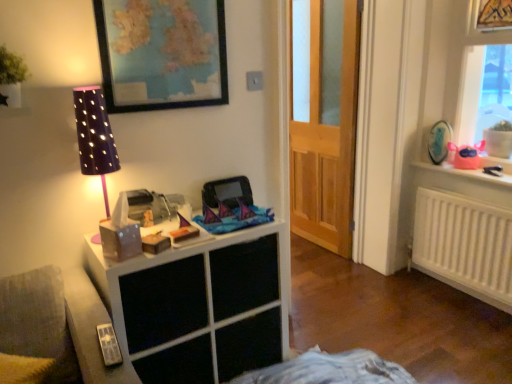
Find the location of `free point below white matte radiator at right (from a real-world perspective)`. free point below white matte radiator at right (from a real-world perspective) is located at coordinates (463, 293).